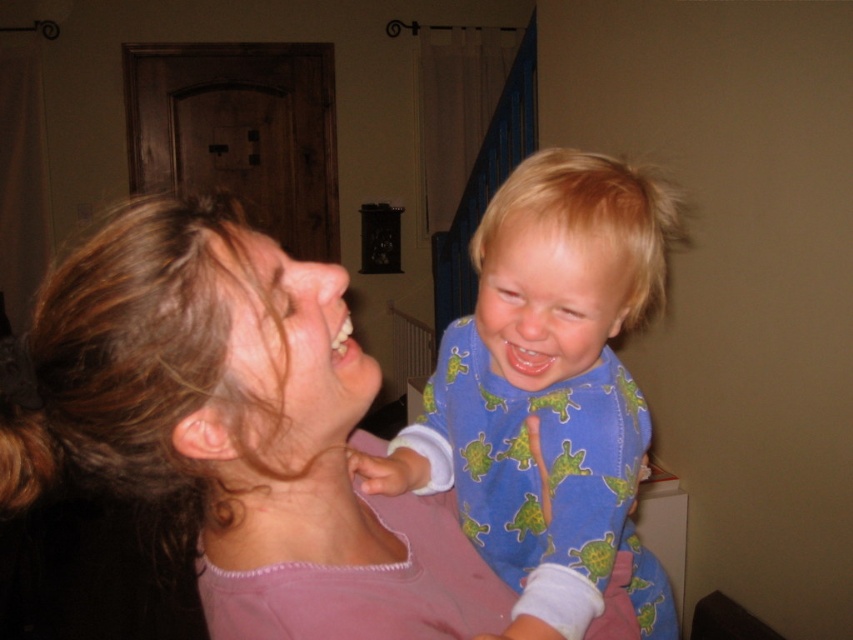
Locate an element on the screen. The image size is (853, 640). pink fabric shirt at upper left is located at coordinates (236, 429).

Between pink fabric shirt at upper left and blue soft pajamas at center, which one is positioned lower?

blue soft pajamas at center is lower down.

Which is behind, point (335, 300) or point (618, 515)?

The point (618, 515) is behind.

Locate an element on the screen. The width and height of the screenshot is (853, 640). pink fabric shirt at upper left is located at coordinates (236, 429).